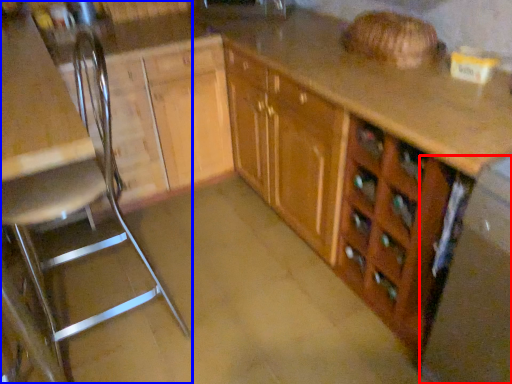
Question: Which object appears closest to the camera in this image, appliance (highlighted by a red box) or chair (highlighted by a blue box)?

Choices:
 (A) appliance
 (B) chair

Answer: (A)